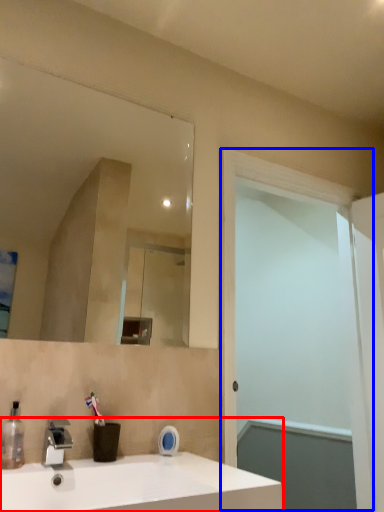
Question: Which point is closer to the camera, sink (highlighted by a red box) or screen door (highlighted by a blue box)?

Choices:
 (A) sink
 (B) screen door

Answer: (A)